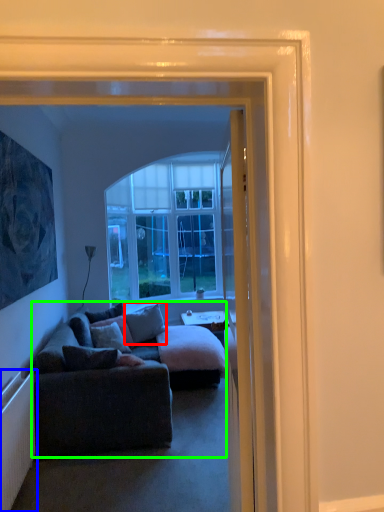
Question: Which object is positioned farthest from pillow (highlighted by a red box)? Select from radiator (highlighted by a blue box) and studio couch (highlighted by a green box).

Choices:
 (A) radiator
 (B) studio couch

Answer: (A)